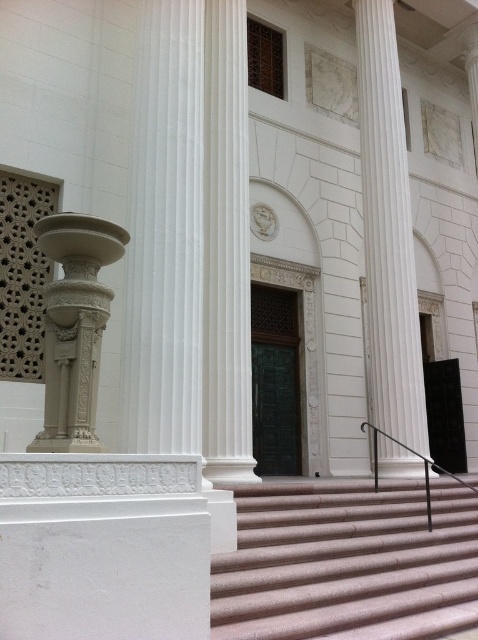
Which is below, pink textured stairs at center or white carved stone column at left?

pink textured stairs at center is below.

Between point (253, 488) and point (57, 246), which one is positioned behind?

The point (253, 488) is more distant.

Where is `pink textured stairs at center`? This screenshot has height=640, width=478. pink textured stairs at center is located at coordinates (347, 563).

Which is in front, point (447, 493) or point (378, 428)?

Point (447, 493) is more forward.

Is pink textured stairs at center above black metal/rail at center-right?

Incorrect, pink textured stairs at center is not positioned above black metal/rail at center-right.

Which is in front, point (332, 493) or point (431, 531)?

Point (431, 531) is more forward.

Locate an element on the screen. pink textured stairs at center is located at coordinates coord(347,563).

Who is higher up, white carved stone column at left or black metal/rail at center-right?

white carved stone column at left is above.

Is white carved stone column at left to the right of black metal/rail at center-right from the viewer's perspective?

In fact, white carved stone column at left is to the left of black metal/rail at center-right.

Which is in front, point (66, 424) or point (470, 486)?

Point (66, 424) is more forward.

Locate an element on the screen. The width and height of the screenshot is (478, 640). white carved stone column at left is located at coordinates (75, 326).